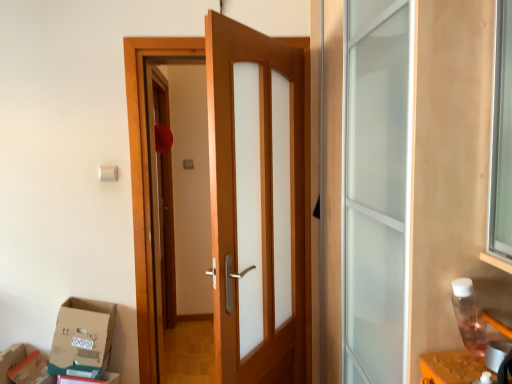
Question: Considering the relative positions of wooden door at center and teal cardboard box at lower left, which ranks as the 2th cardboard box in right-to-left order, in the image provided, is wooden door at center to the left or to the right of teal cardboard box at lower left, which ranks as the 2th cardboard box in right-to-left order,?

Choices:
 (A) left
 (B) right

Answer: (B)

Question: Considering their positions, is wooden door at center located in front of or behind teal cardboard box at lower left, which appears as the 1th cardboard box when viewed from the left?

Choices:
 (A) behind
 (B) front

Answer: (A)

Question: Which is farther from the cardboard box at lower left?

Choices:
 (A) cardboard box at lower left, which is the 2th cardboard box from left to right
 (B) teal cardboard box at lower left, which appears as the 1th cardboard box when viewed from the left
 (C) wooden door at center

Answer: (C)

Question: Based on their relative distances, which object is nearer to the cardboard box at lower left?

Choices:
 (A) teal cardboard box at lower left, which ranks as the 2th cardboard box in right-to-left order
 (B) cardboard box at lower left, which is the 2th cardboard box from left to right
 (C) wooden door at center

Answer: (A)